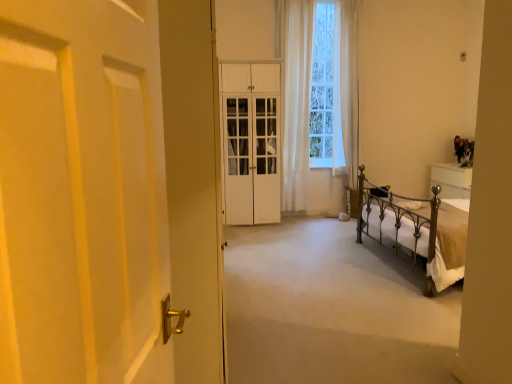
Question: Can you confirm if white matte door at left is smaller than white glossy cabinet at center?

Choices:
 (A) no
 (B) yes

Answer: (B)

Question: Considering the relative sizes of white matte door at left and white glossy cabinet at center in the image provided, is white matte door at left thinner than white glossy cabinet at center?

Choices:
 (A) no
 (B) yes

Answer: (B)

Question: From the image's perspective, is white matte door at left on white glossy cabinet at center?

Choices:
 (A) yes
 (B) no

Answer: (B)

Question: Is white matte door at left aimed at white glossy cabinet at center?

Choices:
 (A) no
 (B) yes

Answer: (A)

Question: Is white matte door at left taller than white glossy cabinet at center?

Choices:
 (A) no
 (B) yes

Answer: (A)

Question: Is white matte door at left outside white glossy cabinet at center?

Choices:
 (A) no
 (B) yes

Answer: (B)

Question: From the image's perspective, is white matte door at left beneath white sheer curtain at center?

Choices:
 (A) yes
 (B) no

Answer: (A)

Question: Is white matte door at left oriented towards white sheer curtain at center?

Choices:
 (A) no
 (B) yes

Answer: (A)

Question: From a real-world perspective, is white matte door at left on top of white sheer curtain at center?

Choices:
 (A) yes
 (B) no

Answer: (B)

Question: Is white matte door at left far from white sheer curtain at center?

Choices:
 (A) no
 (B) yes

Answer: (B)

Question: Would you say white matte door at left is outside white sheer curtain at center?

Choices:
 (A) yes
 (B) no

Answer: (A)

Question: Is white matte door at left closer to camera compared to white sheer curtain at center?

Choices:
 (A) yes
 (B) no

Answer: (A)

Question: Is white glossy cabinet at center facing towards white matte door at left?

Choices:
 (A) no
 (B) yes

Answer: (B)